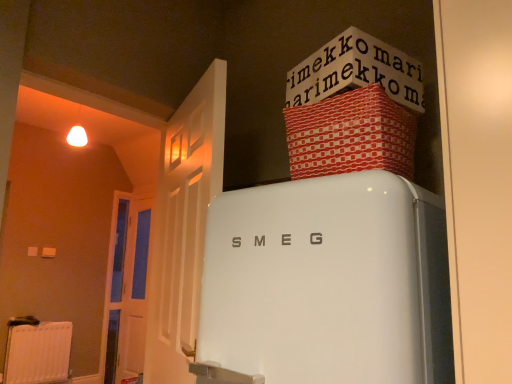
The height and width of the screenshot is (384, 512). Find the location of `white glossy refrigerator at center`. white glossy refrigerator at center is located at coordinates (328, 282).

Describe the element at coordinates (184, 226) in the screenshot. This screenshot has width=512, height=384. I see `white wooden door at left, arranged as the first door when viewed from the right` at that location.

What is the approximate width of white plastic radiator at lower left?

It is 4.55 inches.

What is the approximate width of white wooden door at left, the 1th door positioned from the back?

5.92 inches.

Locate an element on the screen. white glossy refrigerator at center is located at coordinates (328, 282).

Are white plastic radiator at lower left and red textured fabric box at upper right far apart?

Yes.

Find the location of a particular element. cardboard box lying on the right of white plastic radiator at lower left is located at coordinates (351, 135).

How different are the orientations of white plastic radiator at lower left and red textured fabric box at upper right in degrees?

white plastic radiator at lower left and red textured fabric box at upper right are facing 83.3 degrees away from each other.

Is red textured fabric box at upper right inside white plastic radiator at lower left?

No, red textured fabric box at upper right is located outside of white plastic radiator at lower left.

In terms of width, does white plastic radiator at lower left look wider or thinner when compared to white glossy refrigerator at center?

In the image, white plastic radiator at lower left appears to be more narrow than white glossy refrigerator at center.

From the image's perspective, is white plastic radiator at lower left located above or below white glossy refrigerator at center?

white plastic radiator at lower left is situated lower than white glossy refrigerator at center in the image.

Considering the relative sizes of white plastic radiator at lower left and white glossy refrigerator at center in the image provided, is white plastic radiator at lower left taller than white glossy refrigerator at center?

In fact, white plastic radiator at lower left may be shorter than white glossy refrigerator at center.

From a real-world perspective, is white paper at upper center located higher than white wooden door at left, arranged as the first door when viewed from the right?

Yes.

Can white wooden door at left, arranged as the first door when viewed from the right, be found inside white paper at upper center?

No, white wooden door at left, arranged as the first door when viewed from the right, is not inside white paper at upper center.

Considering the positions of point (306, 84) and point (195, 168), is point (306, 84) closer or farther from the camera than point (195, 168)?

Clearly, point (306, 84) is closer to the camera than point (195, 168).

Is white paper at upper center looking in the opposite direction of white wooden door at left, arranged as the first door when viewed from the right?

No.

Which of these two, white wooden door at left, positioned as the second door in right-to-left order, or white wooden door at left, the first door from the front, stands shorter?

With less height is white wooden door at left, the first door from the front.

Is white wooden door at left, positioned as the second door in right-to-left order, far away from white wooden door at left, arranged as the first door when viewed from the right?

Yes, white wooden door at left, positioned as the second door in right-to-left order, and white wooden door at left, arranged as the first door when viewed from the right, are quite far apart.

Is white wooden door at left, which ranks as the first door in left-to-right order, in front of or behind white wooden door at left, the first door from the front, in the image?

In the image, white wooden door at left, which ranks as the first door in left-to-right order, appears behind white wooden door at left, the first door from the front.

Is white wooden door at left, arranged as the 2th door when viewed from the front, at the left side of white wooden door at left, which is counted as the 2th door, starting from the left?

Correct, you'll find white wooden door at left, arranged as the 2th door when viewed from the front, to the left of white wooden door at left, which is counted as the 2th door, starting from the left.

Is white wooden door at left, which ranks as the first door in left-to-right order, wider than white paper at upper center?

No.

Is white wooden door at left, the 1th door positioned from the back, facing away from white paper at upper center?

white wooden door at left, the 1th door positioned from the back, is not turned away from white paper at upper center.

Which is more to the left, white wooden door at left, which ranks as the first door in left-to-right order, or white paper at upper center?

white wooden door at left, which ranks as the first door in left-to-right order.

You are a GUI agent. You are given a task and a screenshot of the screen. Output one action in this format:
    pyautogui.click(x=<x>, y=<y>)
    Task: Click on the 2nd door below the white paper at upper center (from the image's perspective)
    The width and height of the screenshot is (512, 384).
    Given the screenshot: What is the action you would take?
    pyautogui.click(x=128, y=289)

Is white plastic radiator at lower left smaller than white paper at upper center?

Actually, white plastic radiator at lower left might be larger than white paper at upper center.

Is white plastic radiator at lower left thinner than white paper at upper center?

Yes.

From a real-world perspective, is white plastic radiator at lower left beneath white paper at upper center?

Correct, in the physical world, white plastic radiator at lower left is lower than white paper at upper center.

In the image, is white plastic radiator at lower left positioned in front of or behind white paper at upper center?

Visually, white plastic radiator at lower left is located behind white paper at upper center.

Does white plastic radiator at lower left appear on the right side of white wooden door at left, which ranks as the first door in left-to-right order?

In fact, white plastic radiator at lower left is to the left of white wooden door at left, which ranks as the first door in left-to-right order.

Considering the relative sizes of white plastic radiator at lower left and white wooden door at left, positioned as the second door in right-to-left order, in the image provided, is white plastic radiator at lower left bigger than white wooden door at left, positioned as the second door in right-to-left order,?

No, white plastic radiator at lower left is not bigger than white wooden door at left, positioned as the second door in right-to-left order.

Considering the relative sizes of white plastic radiator at lower left and white wooden door at left, arranged as the 2th door when viewed from the front, in the image provided, is white plastic radiator at lower left thinner than white wooden door at left, arranged as the 2th door when viewed from the front,?

Correct, the width of white plastic radiator at lower left is less than that of white wooden door at left, arranged as the 2th door when viewed from the front.

From the image's perspective, who appears lower, white plastic radiator at lower left or white wooden door at left, the 1th door positioned from the back?

white plastic radiator at lower left is shown below in the image.

Identify the location of radiator below the red textured fabric box at upper right (from a real-world perspective). [x=38, y=353].

In the image, there is a white glossy refrigerator at center. Where is `radiator below it (from the image's perspective)`? radiator below it (from the image's perspective) is located at coordinates (38, 353).

Looking at the image, which one is located further to white plastic radiator at lower left, white paper at upper center or white wooden door at left, positioned as the second door in right-to-left order?

white paper at upper center lies further to white plastic radiator at lower left than the other object.

Considering their positions, is white wooden door at left, which ranks as the 2th door in back-to-front order, positioned closer to white glossy refrigerator at center than white paper at upper center?

white paper at upper center is positioned closer to the anchor white glossy refrigerator at center.

Consider the image. Based on their spatial positions, is white plastic radiator at lower left or white wooden door at left, which is counted as the 2th door, starting from the left, further from white wooden door at left, the 1th door positioned from the back?

white wooden door at left, which is counted as the 2th door, starting from the left, lies further to white wooden door at left, the 1th door positioned from the back, than the other object.

When comparing their distances from white wooden door at left, which ranks as the first door in left-to-right order, does white paper at upper center or white wooden door at left, which ranks as the 2th door in back-to-front order, seem closer?

white wooden door at left, which ranks as the 2th door in back-to-front order, is positioned closer to the anchor white wooden door at left, which ranks as the first door in left-to-right order.

Which object lies nearer to the anchor point white paper at upper center, white plastic radiator at lower left or white wooden door at left, arranged as the 2th door when viewed from the front?

white wooden door at left, arranged as the 2th door when viewed from the front, is positioned closer to the anchor white paper at upper center.

Looking at this image, based on their spatial positions, is white paper at upper center or red textured fabric box at upper right closer to white wooden door at left, positioned as the second door in right-to-left order?

Result: red textured fabric box at upper right lies closer to white wooden door at left, positioned as the second door in right-to-left order, than the other object.

Considering their positions, is white glossy refrigerator at center positioned closer to white wooden door at left, the 1th door positioned from the back, than white wooden door at left, arranged as the first door when viewed from the right?

white wooden door at left, arranged as the first door when viewed from the right, is closer to white wooden door at left, the 1th door positioned from the back.

From the picture: Looking at the image, which one is located further to white glossy refrigerator at center, white wooden door at left, positioned as the second door in right-to-left order, or red textured fabric box at upper right?

white wooden door at left, positioned as the second door in right-to-left order, is positioned further to the anchor white glossy refrigerator at center.

You are a GUI agent. You are given a task and a screenshot of the screen. Output one action in this format:
    pyautogui.click(x=<x>, y=<y>)
    Task: Click on the cardboard box between white glossy refrigerator at center and white wooden door at left, arranged as the 2th door when viewed from the front, in the front-back direction
    This screenshot has width=512, height=384.
    Given the screenshot: What is the action you would take?
    click(x=351, y=135)

The image size is (512, 384). I want to click on refrigerator between white wooden door at left, which is counted as the 2th door, starting from the left, and red textured fabric box at upper right, in the horizontal direction, so click(x=328, y=282).

Where is `cardboard box between white paper at upper center and white glossy refrigerator at center in the up-down direction`? cardboard box between white paper at upper center and white glossy refrigerator at center in the up-down direction is located at coordinates (351, 135).

This screenshot has width=512, height=384. What are the coordinates of `writing between red textured fabric box at upper right and white wooden door at left, the 1th door positioned from the back, from front to back` in the screenshot? It's located at (356, 71).